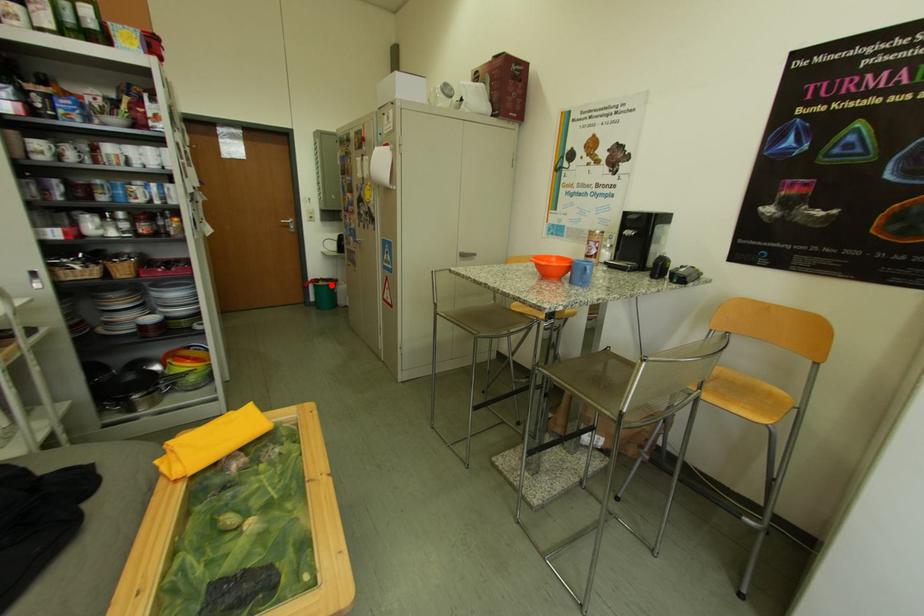
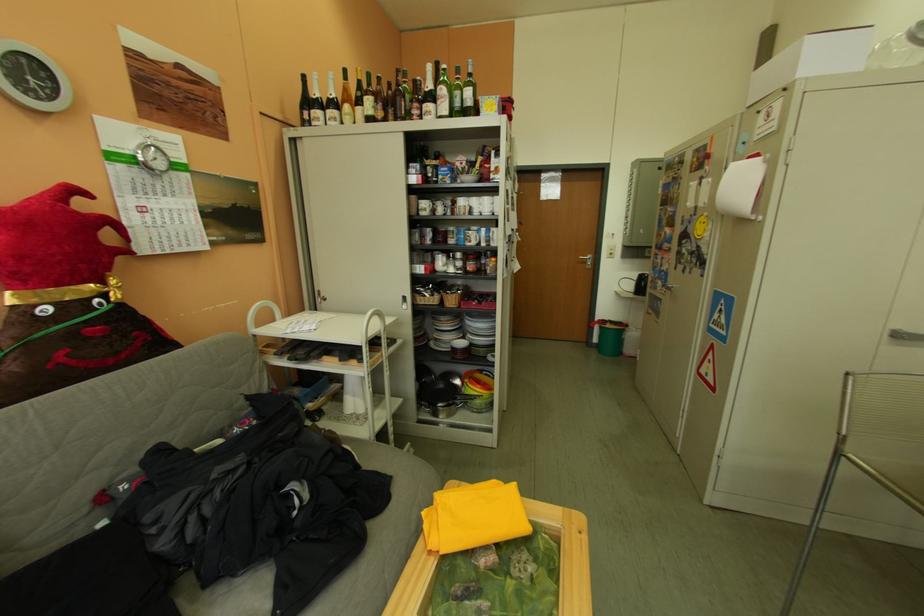
Question: I am providing you with two images of the same scene from different viewpoints. A red point is shown in image1. For the corresponding object point in image2, is it positioned nearer or farther from the camera?

Choices:
 (A) Nearer
 (B) Farther

Answer: (A)